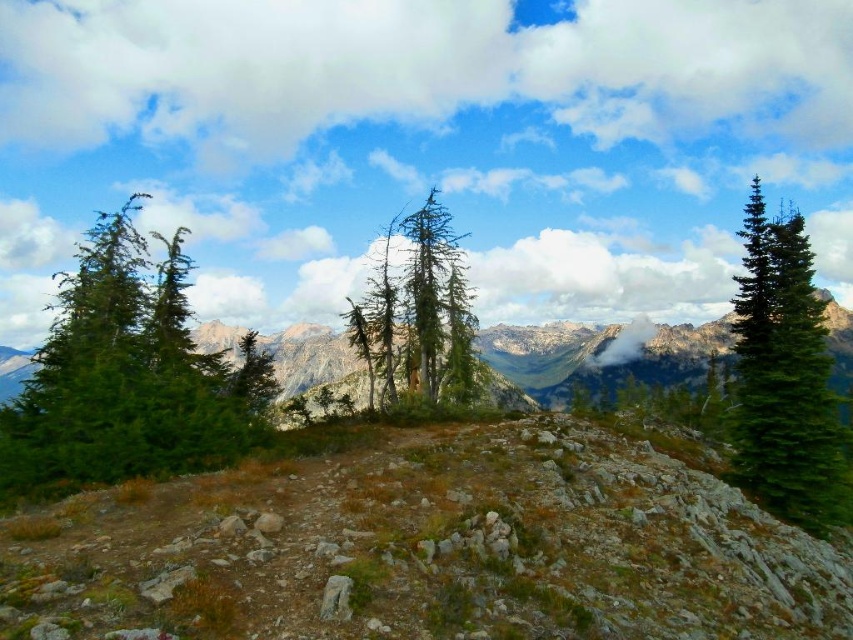
You are a hiker trying to navigate through the rocky terrain. You see two points marked on the ground. Which point is closer to you, point (160, 288) or point (407, 289)?

Point (160, 288) is closer to you than point (407, 289).

You are a hiker who wants to take a photo of the mountain peaks in the background. You notice the green matte tree at left and the green textured tree at center. Which tree might block your view of the mountains if you stand in between them?

The green matte tree at left is in front of the green textured tree at center, so standing between them, the green matte tree at left would block your view of the mountain peaks first.